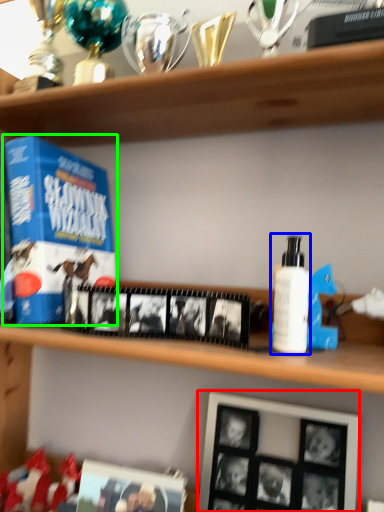
Question: Considering the real-world distances, which object is closest to picture frame (highlighted by a red box)? toiletry (highlighted by a blue box) or product (highlighted by a green box).

Choices:
 (A) toiletry
 (B) product

Answer: (A)